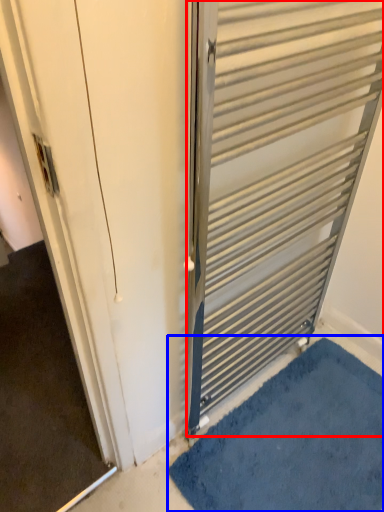
Question: Which object is closer to the camera taking this photo, door (highlighted by a red box) or bath mat (highlighted by a blue box)?

Choices:
 (A) door
 (B) bath mat

Answer: (A)